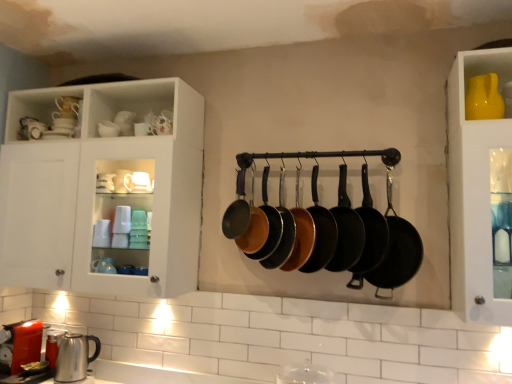
The height and width of the screenshot is (384, 512). What do you see at coordinates (485, 84) in the screenshot? I see `yellow glossy vase at upper right` at bounding box center [485, 84].

What are the coordinates of `matte black frying pan at center, placed as the 3th frying pan when sorted from left to right` in the screenshot? It's located at (283, 231).

What do you see at coordinates (369, 235) in the screenshot?
I see `black non-stick frying pan at center, the second frying pan when ordered from right to left` at bounding box center [369, 235].

At what (x,y) coordinates should I click in order to perform the action: click on black cast iron frying pan at center, which is counted as the 1th frying pan, starting from the right. Please return your answer as a coordinate pair (x, y). This screenshot has width=512, height=384. Looking at the image, I should click on click(397, 250).

Measure the distance between matte black frying pan at center, positioned as the eighth frying pan in right-to-left order, and camera.

They are 2.00 meters apart.

What do you see at coordinates (237, 211) in the screenshot? I see `matte black frying pan at center, positioned as the eighth frying pan in right-to-left order` at bounding box center [237, 211].

Locate an element on the screen. The height and width of the screenshot is (384, 512). satin silver kettle at lower left is located at coordinates (74, 358).

The height and width of the screenshot is (384, 512). Identify the location of the 7th frying pan to the right when counting from the white glossy cabinet at upper left. click(369, 235).

Is black non-stick frying pan at center, the second frying pan when ordered from right to left, inside white glossy cabinet at upper left?

Actually, black non-stick frying pan at center, the second frying pan when ordered from right to left, is outside white glossy cabinet at upper left.

Which is less distant, (x=30, y=205) or (x=349, y=285)?

The point (x=349, y=285) is more forward.

Can you see white glossy cabinet at upper left touching black non-stick frying pan at center, the second frying pan when ordered from right to left?

No, white glossy cabinet at upper left is not in contact with black non-stick frying pan at center, the second frying pan when ordered from right to left.

Could you tell me if yellow glossy vase at upper right is facing matte black frying pan at center, the fifth frying pan in the left-to-right sequence?

No, yellow glossy vase at upper right does not turn towards matte black frying pan at center, the fifth frying pan in the left-to-right sequence.

From the picture: From a real-world perspective, is yellow glossy vase at upper right under matte black frying pan at center, acting as the 4th frying pan starting from the right?

No.

From the yellow glossy vase at upper right, count 4th frying pans backward and point to it. Please provide its 2D coordinates.

[(320, 231)]

Who is bigger, yellow glossy vase at upper right or matte black frying pan at center, acting as the 4th frying pan starting from the right?

Bigger between the two is matte black frying pan at center, acting as the 4th frying pan starting from the right.

Is matte black frying pan at center, placed as the 3th frying pan when sorted from left to right, next to matte black frying pan at center, the fifth frying pan positioned from the right?

Yes, the surface of matte black frying pan at center, placed as the 3th frying pan when sorted from left to right, is in contact with matte black frying pan at center, the fifth frying pan positioned from the right.

From a real-world perspective, is matte black frying pan at center, which is the sixth frying pan from right to left, above or below matte black frying pan at center, which appears as the 4th frying pan when viewed from the left?

matte black frying pan at center, which is the sixth frying pan from right to left, is situated higher than matte black frying pan at center, which appears as the 4th frying pan when viewed from the left, in the real world.

How much distance is there between matte black frying pan at center, placed as the 3th frying pan when sorted from left to right, and matte black frying pan at center, the fifth frying pan positioned from the right?

matte black frying pan at center, placed as the 3th frying pan when sorted from left to right, is 1.89 inches away from matte black frying pan at center, the fifth frying pan positioned from the right.

Would you say matte black frying pan at center, which is the sixth frying pan from right to left, contains matte black frying pan at center, which appears as the 4th frying pan when viewed from the left?

Yes, matte black frying pan at center, which appears as the 4th frying pan when viewed from the left, is a part of matte black frying pan at center, which is the sixth frying pan from right to left.

Identify the location of the 1st frying pan directly beneath the yellow glossy vase at upper right (from a real-world perspective). Image resolution: width=512 pixels, height=384 pixels. coord(237,211).

In the image, is yellow glossy vase at upper right on the left side or the right side of matte black frying pan at center, which appears as the first frying pan when viewed from the left?

Clearly, yellow glossy vase at upper right is on the right of matte black frying pan at center, which appears as the first frying pan when viewed from the left, in the image.

Is matte black frying pan at center, which appears as the first frying pan when viewed from the left, at the back of yellow glossy vase at upper right?

yellow glossy vase at upper right does not have its back to matte black frying pan at center, which appears as the first frying pan when viewed from the left.

From a real-world perspective, is yellow glossy vase at upper right positioned under satin silver kettle at lower left based on gravity?

No, from a real-world perspective, yellow glossy vase at upper right is not below satin silver kettle at lower left.

Identify the location of appliance below the yellow glossy vase at upper right (from a real-world perspective). tap(74, 358).

Visually, is yellow glossy vase at upper right positioned to the left or to the right of satin silver kettle at lower left?

Clearly, yellow glossy vase at upper right is on the right of satin silver kettle at lower left in the image.

Would you say matte black frying pan at center, which appears as the 4th frying pan when viewed from the left, is outside matte orange frying pan at center, which ranks as the second frying pan in left-to-right order?

That's correct, matte black frying pan at center, which appears as the 4th frying pan when viewed from the left, is outside of matte orange frying pan at center, which ranks as the second frying pan in left-to-right order.

There is a matte black frying pan at center, which appears as the 4th frying pan when viewed from the left. Where is `the 2nd frying pan above it (from a real-world perspective)`? This screenshot has height=384, width=512. the 2nd frying pan above it (from a real-world perspective) is located at coordinates (254, 227).

Is matte black frying pan at center, the fifth frying pan positioned from the right, positioned with its back to matte orange frying pan at center, which is counted as the 7th frying pan, starting from the right?

No, matte black frying pan at center, the fifth frying pan positioned from the right,'s orientation is not away from matte orange frying pan at center, which is counted as the 7th frying pan, starting from the right.

Is matte black frying pan at center, which appears as the 4th frying pan when viewed from the left, shorter than matte orange frying pan at center, which is counted as the 7th frying pan, starting from the right?

No, matte black frying pan at center, which appears as the 4th frying pan when viewed from the left, is not shorter than matte orange frying pan at center, which is counted as the 7th frying pan, starting from the right.

Measure the distance between white glossy cabinet at upper left and matte black frying pan at center, which appears as the first frying pan when viewed from the left.

white glossy cabinet at upper left is 60.95 centimeters from matte black frying pan at center, which appears as the first frying pan when viewed from the left.

This screenshot has width=512, height=384. There is a white glossy cabinet at upper left. What are the coordinates of `the 1st frying pan below it (from a real-world perspective)` in the screenshot? It's located at (237, 211).

Considering the points (197, 168) and (241, 232), which point is in front, point (197, 168) or point (241, 232)?

The point (241, 232) is more forward.

From the image's perspective, between white glossy cabinet at upper left and matte black frying pan at center, which appears as the first frying pan when viewed from the left, which one is located above?

white glossy cabinet at upper left.

Where is `cabinetry lying on the left of black non-stick frying pan at center, the 7th frying pan from the left`? cabinetry lying on the left of black non-stick frying pan at center, the 7th frying pan from the left is located at coordinates (102, 191).

Identify the location of the 4th frying pan behind when counting from the yellow glossy vase at upper right. (320, 231).

Estimate the real-world distances between objects in this image. Which object is further from black cast iron frying pan at center, which is the 8th frying pan in left-to-right order, matte black frying pan at center, acting as the 4th frying pan starting from the right, or black non-stick frying pan at center, the second frying pan when ordered from right to left?

The object further to black cast iron frying pan at center, which is the 8th frying pan in left-to-right order, is matte black frying pan at center, acting as the 4th frying pan starting from the right.

When comparing their distances from yellow glossy vase at upper right, does satin silver kettle at lower left or matte black frying pan at center, which is the sixth frying pan from right to left, seem closer?

matte black frying pan at center, which is the sixth frying pan from right to left, is positioned closer to the anchor yellow glossy vase at upper right.

Considering their positions, is matte black frying pan at center, the fifth frying pan positioned from the right, positioned closer to matte black frying pan at center, positioned as the eighth frying pan in right-to-left order, than matte black frying pan at center, which is the sixth frying pan from right to left?

matte black frying pan at center, which is the sixth frying pan from right to left, is closer to matte black frying pan at center, positioned as the eighth frying pan in right-to-left order.

Which object lies further to the anchor point matte black frying pan at center, the fifth frying pan in the left-to-right sequence, matte black frying pan at center, which appears as the 4th frying pan when viewed from the left, or matte black frying pan at center, positioned as the eighth frying pan in right-to-left order?

matte black frying pan at center, positioned as the eighth frying pan in right-to-left order, is further to matte black frying pan at center, the fifth frying pan in the left-to-right sequence.

Estimate the real-world distances between objects in this image. Which object is closer to white glossy cabinet at upper left, matte orange frying pan at center, which is counted as the 7th frying pan, starting from the right, or yellow glossy vase at upper right?

matte orange frying pan at center, which is counted as the 7th frying pan, starting from the right.

From the picture: From the image, which object appears to be farther from matte black frying pan at center, placed as the 3th frying pan when sorted from left to right, black non-stick frying pan at center, the 7th frying pan from the left, or yellow glossy vase at upper right?

yellow glossy vase at upper right lies further to matte black frying pan at center, placed as the 3th frying pan when sorted from left to right, than the other object.

Considering their positions, is yellow glossy vase at upper right positioned closer to matte black frying pan at center, placed as the 3th frying pan when sorted from left to right, than matte black frying pan at center, the fifth frying pan positioned from the right?

matte black frying pan at center, the fifth frying pan positioned from the right, is closer to matte black frying pan at center, placed as the 3th frying pan when sorted from left to right.

Looking at the image, which one is located closer to matte orange frying pan at center, which ranks as the second frying pan in left-to-right order, matte black frying pan at center, which appears as the first frying pan when viewed from the left, or matte black frying pan at center, which is the sixth frying pan from right to left?

matte black frying pan at center, which appears as the first frying pan when viewed from the left.

This screenshot has width=512, height=384. Identify the location of cabinetry between satin silver kettle at lower left and matte black frying pan at center, acting as the 4th frying pan starting from the right, in the horizontal direction. (102, 191).

Locate an element on the screen. This screenshot has width=512, height=384. frying pan between white glossy cabinet at upper left and matte orange frying pan at center, which is counted as the 7th frying pan, starting from the right, from left to right is located at coordinates (237, 211).

Find the location of a particular element. This screenshot has height=384, width=512. cabinetry between satin silver kettle at lower left and black cast iron frying pan at center, which is counted as the 1th frying pan, starting from the right, from left to right is located at coordinates (102, 191).

The height and width of the screenshot is (384, 512). I want to click on cabinetry located between satin silver kettle at lower left and matte orange frying pan at center, which ranks as the second frying pan in left-to-right order, in the left-right direction, so click(102, 191).